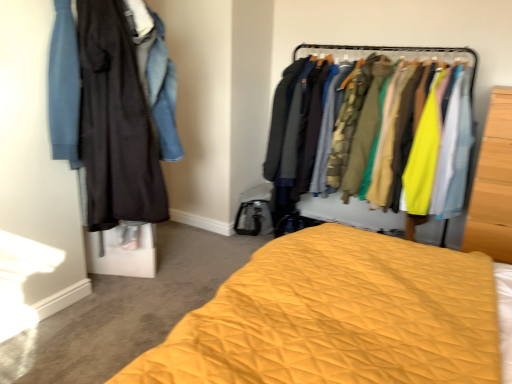
Question: Can you confirm if denim jacket at left, which is counted as the first clothing, starting from the top, is thinner than matte black coat at left, which appears as the 1th clothing when ordered from the bottom?

Choices:
 (A) no
 (B) yes

Answer: (A)

Question: From the image's perspective, is denim jacket at left, which is counted as the first clothing, starting from the top, located above matte black coat at left, placed as the second clothing when sorted from top to bottom?

Choices:
 (A) no
 (B) yes

Answer: (B)

Question: Could you tell me if denim jacket at left, the 2th clothing ordered from the bottom, is facing matte black coat at left, which appears as the 1th clothing when ordered from the bottom?

Choices:
 (A) yes
 (B) no

Answer: (A)

Question: Can you see denim jacket at left, the 2th clothing ordered from the bottom, touching matte black coat at left, placed as the second clothing when sorted from top to bottom?

Choices:
 (A) yes
 (B) no

Answer: (B)

Question: Is denim jacket at left, the 2th clothing ordered from the bottom, positioned in front of matte black coat at left, which appears as the 1th clothing when ordered from the bottom?

Choices:
 (A) no
 (B) yes

Answer: (A)

Question: Does denim jacket at left, the 2th clothing ordered from the bottom, come behind matte black coat at left, which appears as the 1th clothing when ordered from the bottom?

Choices:
 (A) no
 (B) yes

Answer: (B)

Question: From a real-world perspective, is yellow quilted bed at center physically below textured fabric clothes at center?

Choices:
 (A) no
 (B) yes

Answer: (B)

Question: Are yellow quilted bed at center and textured fabric clothes at center making contact?

Choices:
 (A) no
 (B) yes

Answer: (A)

Question: Does yellow quilted bed at center have a lesser height compared to textured fabric clothes at center?

Choices:
 (A) no
 (B) yes

Answer: (B)

Question: Is yellow quilted bed at center in front of textured fabric clothes at center?

Choices:
 (A) yes
 (B) no

Answer: (A)

Question: From the image's perspective, is yellow quilted bed at center above textured fabric clothes at center?

Choices:
 (A) yes
 (B) no

Answer: (B)

Question: Is yellow quilted bed at center oriented away from textured fabric clothes at center?

Choices:
 (A) yes
 (B) no

Answer: (B)

Question: Is the position of textured fabric clothes at center less distant than that of wooden wardrobe at right?

Choices:
 (A) yes
 (B) no

Answer: (B)